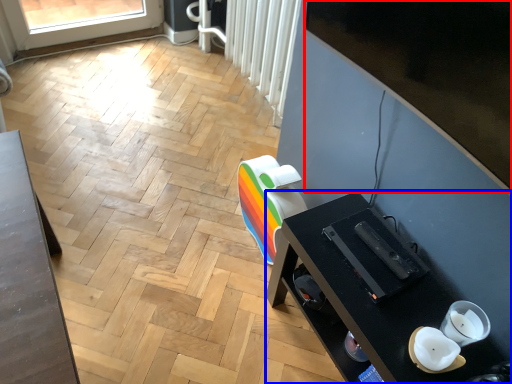
Question: Among these objects, which one is nearest to the camera, window screen (highlighted by a red box) or desk (highlighted by a blue box)?

Choices:
 (A) window screen
 (B) desk

Answer: (A)